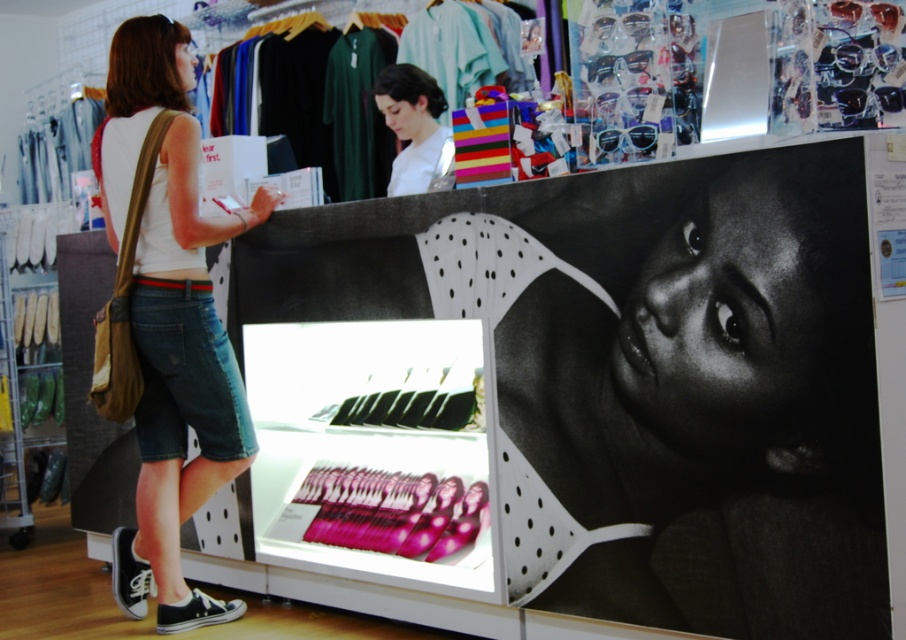
You are a customer standing at the entrance of the store. You want to pick up the metallic silver poster at center to read it better. Can you walk directly to it from your current position?

The metallic silver poster at center is 9.22 feet away from camera, so yes, you can walk directly to it from your current position as it is within a reachable distance.

You are a customer in the store and want to find the denim shorts at left. Based on the coordinates provided, can you determine if they are located to the left or right side of the store?

The denim shorts at left are located at coordinates point (171, 321). Since the x coordinate is 0.503, which is just over halfway, they are positioned slightly to the right side of the store.